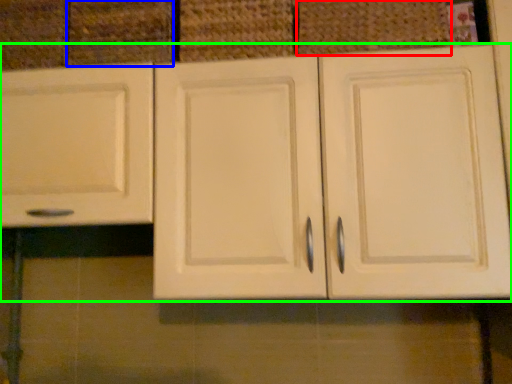
Question: Which object is positioned closest to basket (highlighted by a red box)? Select from drawer (highlighted by a blue box) and cabinetry (highlighted by a green box).

Choices:
 (A) drawer
 (B) cabinetry

Answer: (B)